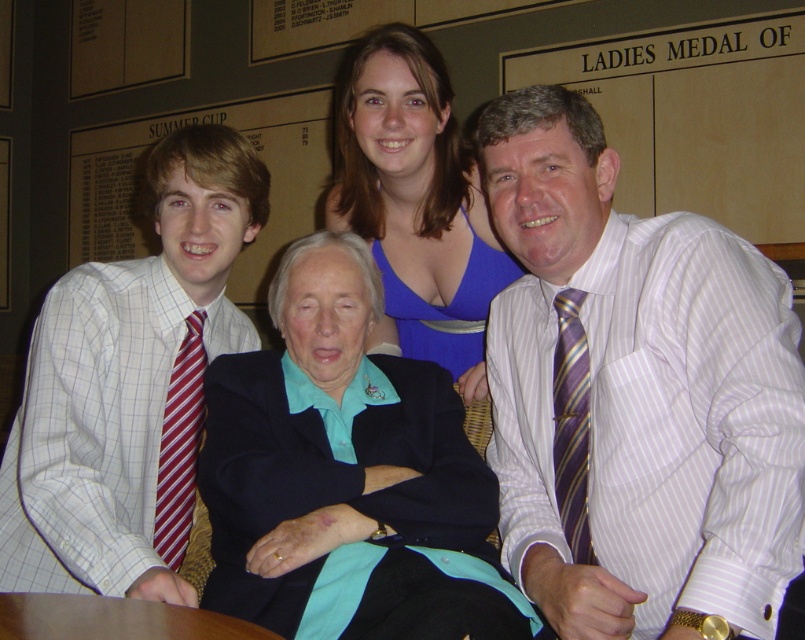
Question: Which object is the closest to the striped silk tie at right?

Choices:
 (A) white checkered shirt at left
 (B) red striped tie at left

Answer: (B)

Question: Is teal fabric jacket at center thinner than red striped tie at left?

Choices:
 (A) no
 (B) yes

Answer: (A)

Question: Which point is farther from the camera taking this photo?

Choices:
 (A) (378, 70)
 (B) (671, 632)
 (C) (552, 420)
 (D) (126, 604)

Answer: (A)

Question: Among these points, which one is farthest from the camera?

Choices:
 (A) (576, 321)
 (B) (329, 461)
 (C) (149, 536)

Answer: (C)

Question: Can you confirm if white striped shirt at right is positioned to the left of striped silk tie at right?

Choices:
 (A) no
 (B) yes

Answer: (B)

Question: Does brown wooden table at lower left come in front of red striped tie at left?

Choices:
 (A) yes
 (B) no

Answer: (A)